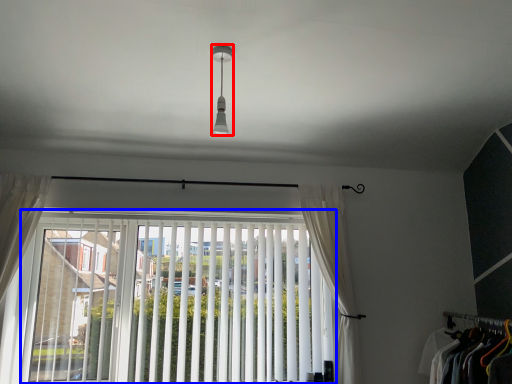
Question: Among these objects, which one is farthest to the camera, light fixture (highlighted by a red box) or window (highlighted by a blue box)?

Choices:
 (A) light fixture
 (B) window

Answer: (B)